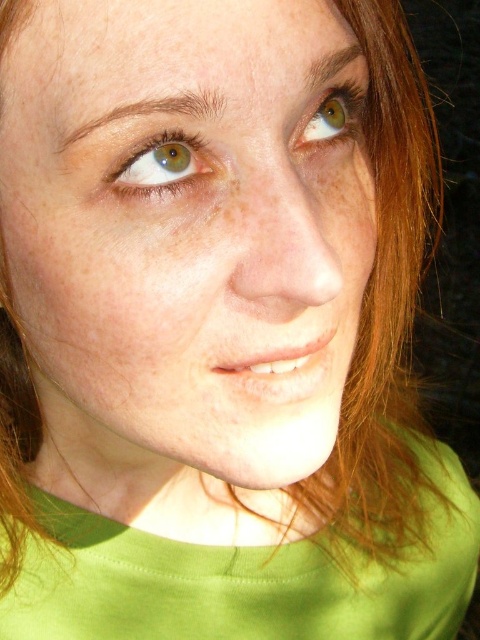
Question: Among these points, which one is farthest from the camera?

Choices:
 (A) (349, 116)
 (B) (85, 276)

Answer: (A)

Question: Which object appears closest to the camera in this image?

Choices:
 (A) green matte eye at upper right
 (B) matte green eye at upper left

Answer: (B)

Question: Is smooth skin face at center to the right of green matte eye at upper right from the viewer's perspective?

Choices:
 (A) yes
 (B) no

Answer: (B)

Question: Which of the following is the farthest from the observer?

Choices:
 (A) matte green eye at upper left
 (B) smooth skin face at center

Answer: (A)

Question: Does matte green eye at upper left have a larger size compared to green matte eye at upper right?

Choices:
 (A) yes
 (B) no

Answer: (B)

Question: Is smooth skin face at center further to camera compared to green matte eye at upper right?

Choices:
 (A) no
 (B) yes

Answer: (A)